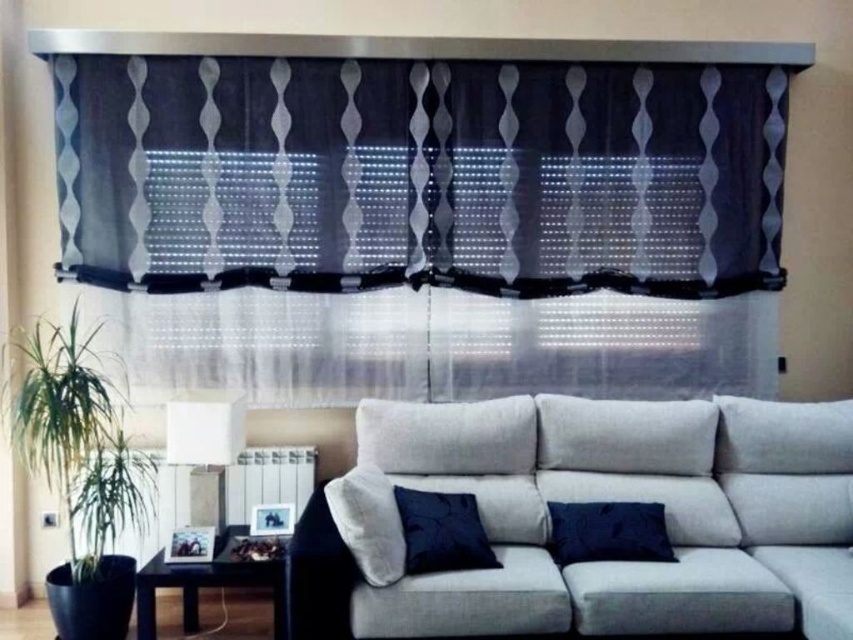
Can you confirm if textured gray curtain at upper center is smaller than velvet dark blue pillow at center?

Actually, textured gray curtain at upper center might be larger than velvet dark blue pillow at center.

Does textured gray curtain at upper center appear on the right side of velvet dark blue pillow at center?

No, textured gray curtain at upper center is not to the right of velvet dark blue pillow at center.

Image resolution: width=853 pixels, height=640 pixels. Find the location of `textured gray curtain at upper center`. textured gray curtain at upper center is located at coordinates (427, 220).

You are a GUI agent. You are given a task and a screenshot of the screen. Output one action in this format:
    pyautogui.click(x=<x>, y=<y>)
    Task: Click on the textured gray curtain at upper center
    
    Given the screenshot: What is the action you would take?
    pyautogui.click(x=427, y=220)

In the scene shown: Is light gray fabric couch at center below green leafy plant at left?

Correct, light gray fabric couch at center is located below green leafy plant at left.

Who is lower down, light gray fabric couch at center or green leafy plant at left?

light gray fabric couch at center

I want to click on light gray fabric couch at center, so click(x=602, y=500).

Does green leafy plant at left lie behind dark blue velvet pillow at lower center?

That is False.

Does green leafy plant at left have a larger size compared to dark blue velvet pillow at lower center?

Indeed, green leafy plant at left has a larger size compared to dark blue velvet pillow at lower center.

Which is in front, point (144, 497) or point (566, 525)?

Point (566, 525) is more forward.

You are a GUI agent. You are given a task and a screenshot of the screen. Output one action in this format:
    pyautogui.click(x=<x>, y=<y>)
    Task: Click on the green leafy plant at left
    This screenshot has height=640, width=853.
    Given the screenshot: What is the action you would take?
    pyautogui.click(x=76, y=436)